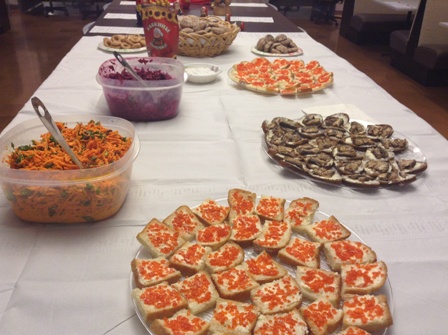
Locate an element on the screen. This screenshot has width=448, height=335. spoon is located at coordinates (51, 125).